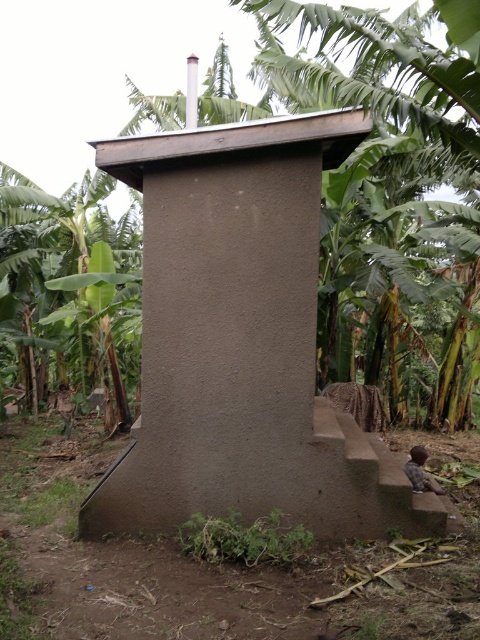
Consider the image. You are standing in front of the building and want to walk to the green leafy plant at left. Which direction should you walk from the green leafy banana tree at center?

The green leafy banana tree at center is to the right of the green leafy plant at left, so you should walk to the left from the green leafy banana tree at center to reach the green leafy plant at left.

You are a botanist studying tropical plants. You notice the green leafy banana tree at center and the green leafy plant at left in the image. Which of these two plants is taller?

The green leafy banana tree at center is taller than the green leafy plant at left.